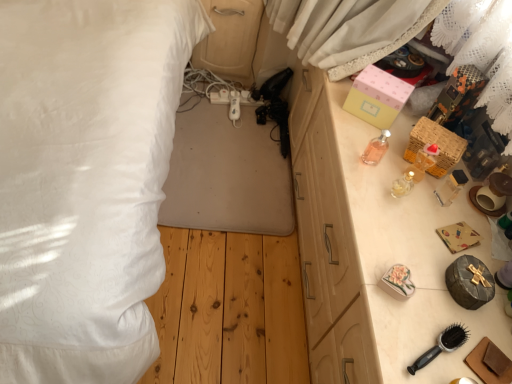
Locate an element on the screen. vacant region to the left of pink glass perfume at upper right is located at coordinates (339, 145).